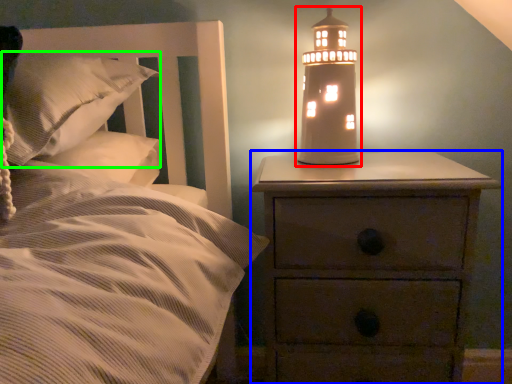
Question: Which object is positioned farthest from oil lamp (highlighted by a red box)? Select from nightstand (highlighted by a blue box) and pillow (highlighted by a green box).

Choices:
 (A) nightstand
 (B) pillow

Answer: (B)